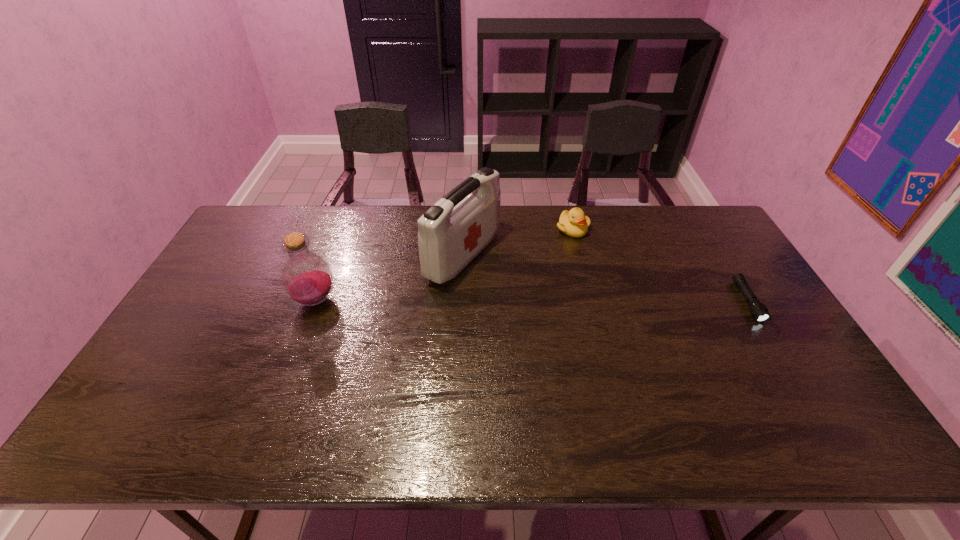
Locate an element on the screen. object that is the third closest one to the bottle is located at coordinates (759, 311).

The width and height of the screenshot is (960, 540). What are the coordinates of `object that stands as the closest to the third object from left to right` in the screenshot? It's located at (451, 233).

Identify the location of free region that satisfies the following two spatial constraints: 1. on the back side of the duckling; 2. on the right side of the third object from right to left. (465, 230).

Locate an element on the screen. The image size is (960, 540). vacant region that satisfies the following two spatial constraints: 1. on the back side of the first-aid kit; 2. on the right side of the third tallest object is located at coordinates coord(465,230).

Where is `free space that satisfies the following two spatial constraints: 1. on the back side of the second shortest object; 2. on the left side of the first-aid kit`? free space that satisfies the following two spatial constraints: 1. on the back side of the second shortest object; 2. on the left side of the first-aid kit is located at coordinates (465, 230).